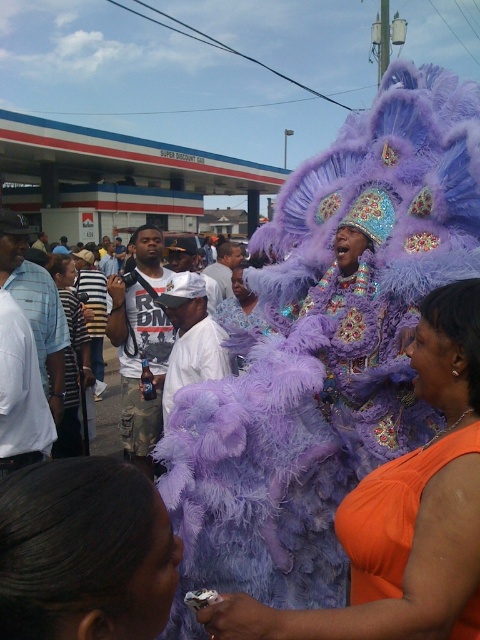
Question: Which point is closer to the camera?

Choices:
 (A) orange satin dress at center
 (B) purple feathered headdress at center
 (C) smooth purple feathered headdress at center

Answer: (C)

Question: Which point is farther to the camera?

Choices:
 (A) (2, 536)
 (B) (476, 634)
 (C) (418, 500)

Answer: (C)

Question: Is orange satin dress at center above smooth purple feathered headdress at center?

Choices:
 (A) yes
 (B) no

Answer: (A)

Question: Is the position of orange satin dress at center less distant than that of smooth purple feathered headdress at center?

Choices:
 (A) no
 (B) yes

Answer: (A)

Question: Which point is farther to the camera?

Choices:
 (A) (368, 627)
 (B) (19, 500)

Answer: (A)

Question: Can you confirm if orange satin dress at center is thinner than purple feathered headdress at center?

Choices:
 (A) no
 (B) yes

Answer: (A)